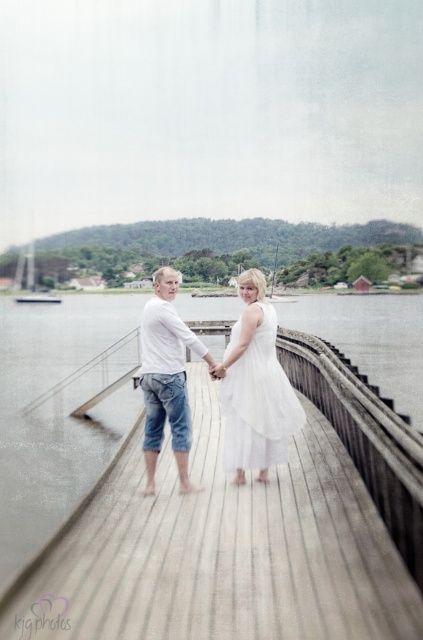
You are a photographer trying to capture both the white cotton dress at center and the white sheer dress at center in the same frame. The minimum distance your camera can focus on two objects clearly is 15 centimeters. Can you fit both dresses into the frame without blurring either?

The white cotton dress at center is 14.98 centimeters from white sheer dress at center, which is just below the 15 centimeter threshold. Therefore, the camera should be able to focus both dresses clearly in the same frame without blurring.

You are standing at point (167, 316) and want to take a photo of the couple on the wooden pier. The camera you are using has a maximum focus range of 20 feet. Will the camera be able to focus on the couple?

The distance between point (167, 316) and the camera is 16.87 feet, which is within the camera maximum focus range of 20 feet. Therefore, the camera can focus on the couple.

You are a photographer trying to capture a photo of the two dresses, white cotton dress at center and white sheer dress at center, on the pier. Which dress should you focus on first if you want to ensure it appears larger in the photo?

The white cotton dress at center is much taller than the white sheer dress at center, so focusing on it first will ensure it appears larger in the photo.